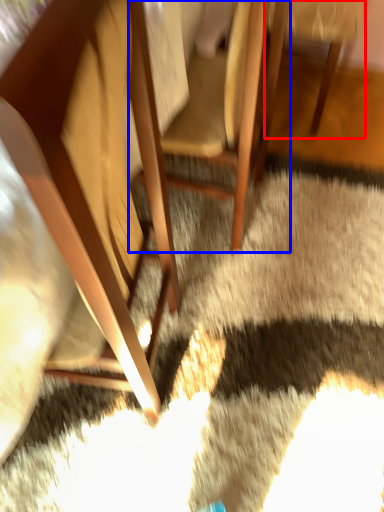
Question: Which point is further to the camera, chair (highlighted by a red box) or chair (highlighted by a blue box)?

Choices:
 (A) chair
 (B) chair

Answer: (A)